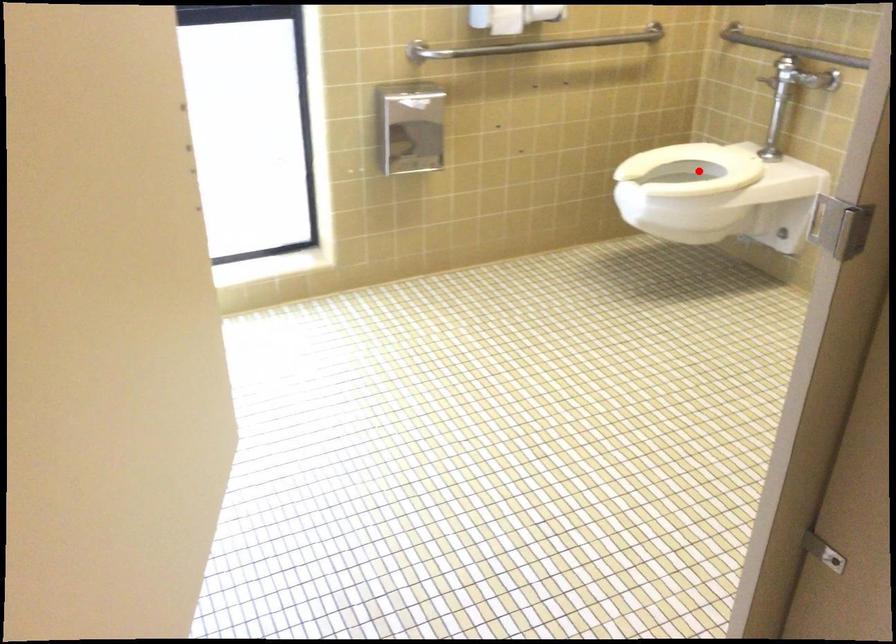
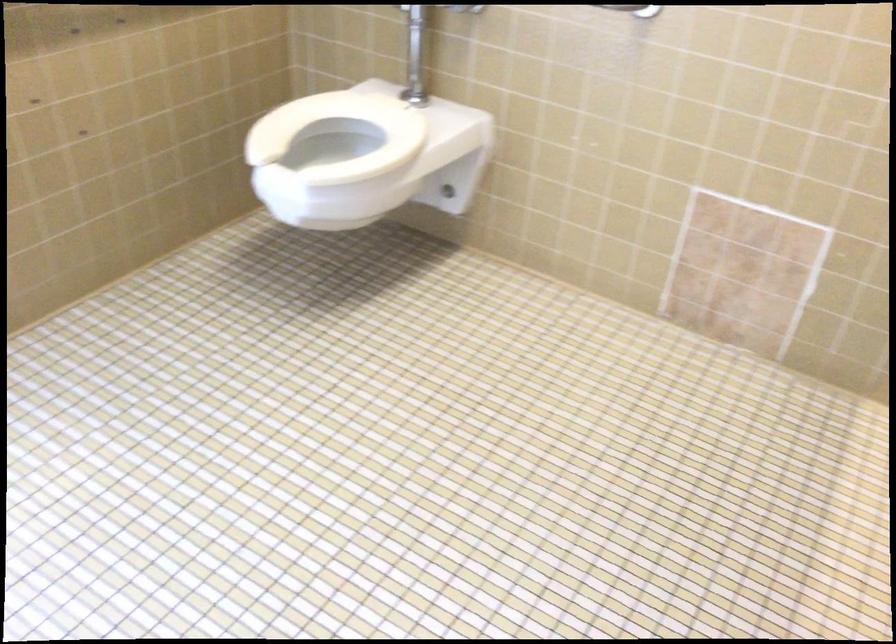
Where in the second image is the point corresponding to the highlighted location from the first image?

(339, 134)